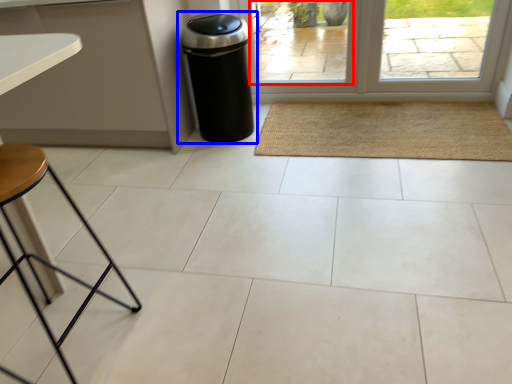
Question: Which object appears farthest to the camera in this image, window (highlighted by a red box) or waste container (highlighted by a blue box)?

Choices:
 (A) window
 (B) waste container

Answer: (A)